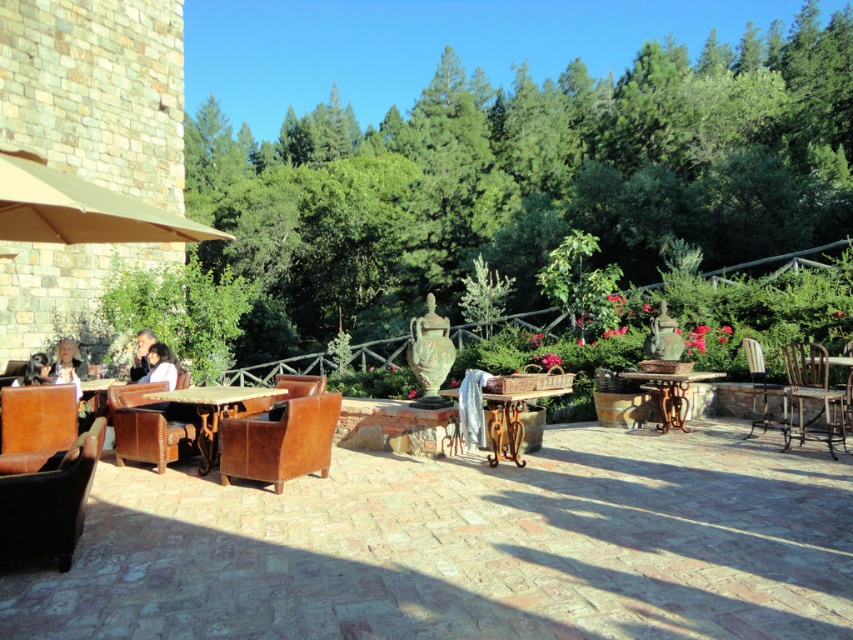
You are a customer looking for a seat in the outdoor patio. You see the metallic brown table at center and the light brown leather chair at left. Which object is closer to you?

The light brown leather chair at left is closer to you because the metallic brown table at center is positioned under it, meaning the chair is above the table from your perspective.